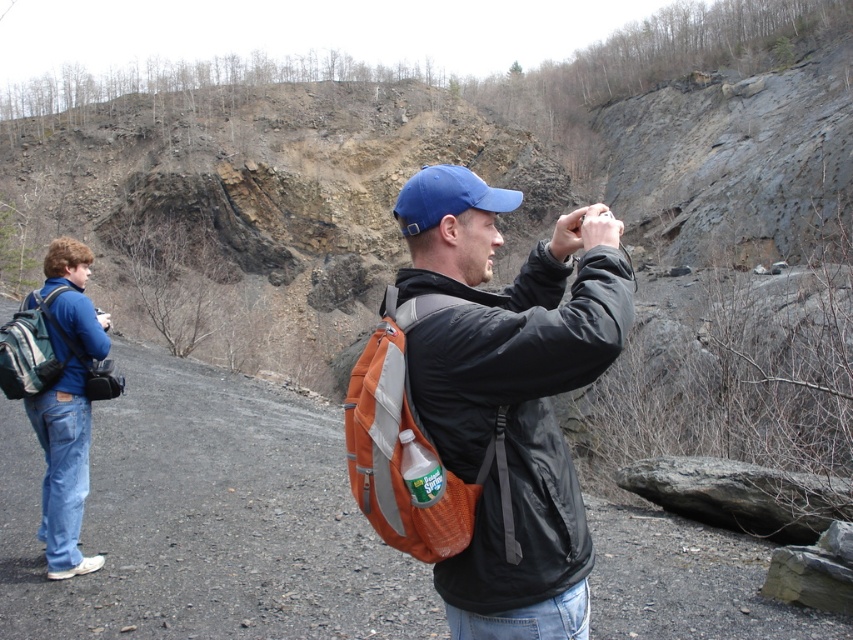
Who is positioned more to the left, matte black jacket at center or orange fabric backpack at center?

Positioned to the left is orange fabric backpack at center.

Is matte black jacket at center to the right of orange fabric backpack at center from the viewer's perspective?

Indeed, matte black jacket at center is positioned on the right side of orange fabric backpack at center.

Find the location of a particular element. The image size is (853, 640). matte black jacket at center is located at coordinates (485, 404).

Between blue denim jeans at left and blue fabric baseball cap at center, which one has less height?

Standing shorter between the two is blue denim jeans at left.

Between point (84, 467) and point (427, 179), which one is positioned behind?

The point (84, 467) is behind.

Image resolution: width=853 pixels, height=640 pixels. Identify the location of blue denim jeans at left. (67, 404).

Is point (454, 528) farther from camera compared to point (48, 280)?

No, (454, 528) is in front of (48, 280).

Does matte black jacket at center have a smaller size compared to blue denim jeans at left?

No, matte black jacket at center is not smaller than blue denim jeans at left.

Between point (426, 461) and point (61, 428), which one is positioned behind?

The point (61, 428) is more distant.

Where is `matte black jacket at center`? The height and width of the screenshot is (640, 853). matte black jacket at center is located at coordinates (485, 404).